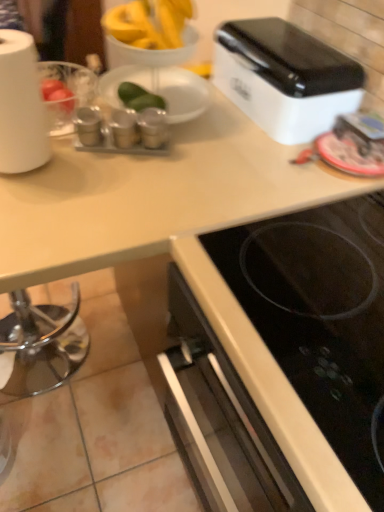
Question: Can you confirm if metallic silver canisters at upper left, which is the 3th appliance in right-to-left order, is smaller than metallic silver spice containers at center, which ranks as the third appliance in left-to-right order?

Choices:
 (A) no
 (B) yes

Answer: (B)

Question: Does metallic silver canisters at upper left, the 1th appliance viewed from the left, turn towards metallic silver spice containers at center, which ranks as the third appliance in left-to-right order?

Choices:
 (A) yes
 (B) no

Answer: (B)

Question: From a real-world perspective, is metallic silver canisters at upper left, which is the 3th appliance in right-to-left order, physically above metallic silver spice containers at center, which appears as the first appliance when viewed from the right?

Choices:
 (A) no
 (B) yes

Answer: (A)

Question: Can we say metallic silver canisters at upper left, which is the 3th appliance in right-to-left order, lies outside metallic silver spice containers at center, which appears as the first appliance when viewed from the right?

Choices:
 (A) yes
 (B) no

Answer: (A)

Question: Is metallic silver canisters at upper left, the 1th appliance viewed from the left, to the left of metallic silver spice containers at center, which appears as the first appliance when viewed from the right, from the viewer's perspective?

Choices:
 (A) yes
 (B) no

Answer: (A)

Question: From the image's perspective, is white glossy toaster at upper right above or below metallic silver canisters at upper left, the 1th appliance viewed from the left?

Choices:
 (A) above
 (B) below

Answer: (A)

Question: Is point (301, 81) positioned closer to the camera than point (94, 137)?

Choices:
 (A) closer
 (B) farther

Answer: (A)

Question: In terms of size, does white glossy toaster at upper right appear bigger or smaller than metallic silver canisters at upper left, which is the 3th appliance in right-to-left order?

Choices:
 (A) big
 (B) small

Answer: (A)

Question: From their relative heights in the image, would you say white glossy toaster at upper right is taller or shorter than metallic silver canisters at upper left, the 1th appliance viewed from the left?

Choices:
 (A) short
 (B) tall

Answer: (B)

Question: From a real-world perspective, is white matte paper towel at left positioned above or below black glass cooktop at lower right?

Choices:
 (A) above
 (B) below

Answer: (A)

Question: Relative to black glass cooktop at lower right, is white matte paper towel at left in front or behind?

Choices:
 (A) behind
 (B) front

Answer: (A)

Question: Is white matte paper towel at left to the left or to the right of black glass cooktop at lower right in the image?

Choices:
 (A) right
 (B) left

Answer: (B)

Question: From the image's perspective, is white matte paper towel at left positioned above or below black glass cooktop at lower right?

Choices:
 (A) above
 (B) below

Answer: (A)

Question: Looking at the image, does white glossy toaster at upper right seem bigger or smaller compared to metallic silver spice containers at center, which appears as the first appliance when viewed from the right?

Choices:
 (A) big
 (B) small

Answer: (A)

Question: In terms of height, does white glossy toaster at upper right look taller or shorter compared to metallic silver spice containers at center, which ranks as the third appliance in left-to-right order?

Choices:
 (A) short
 (B) tall

Answer: (B)